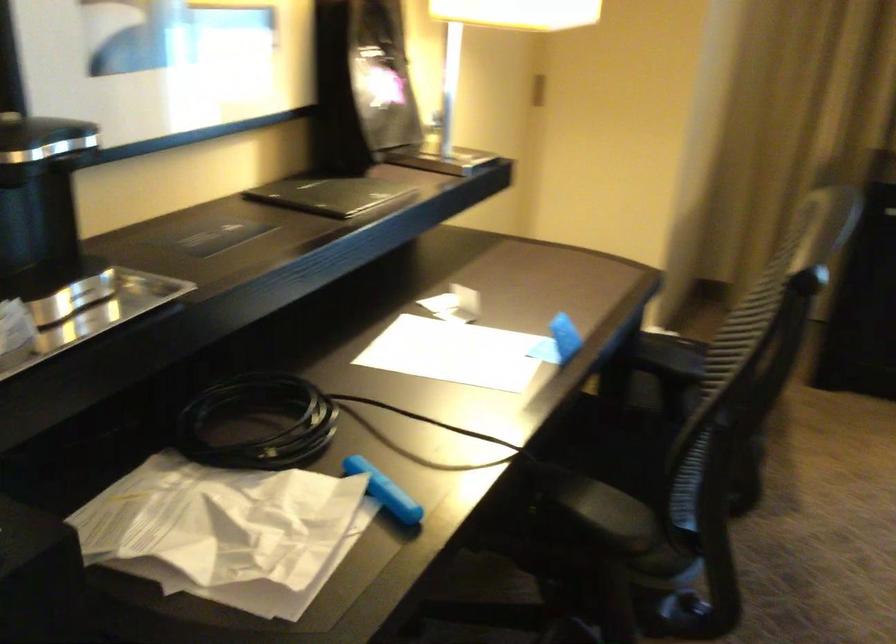
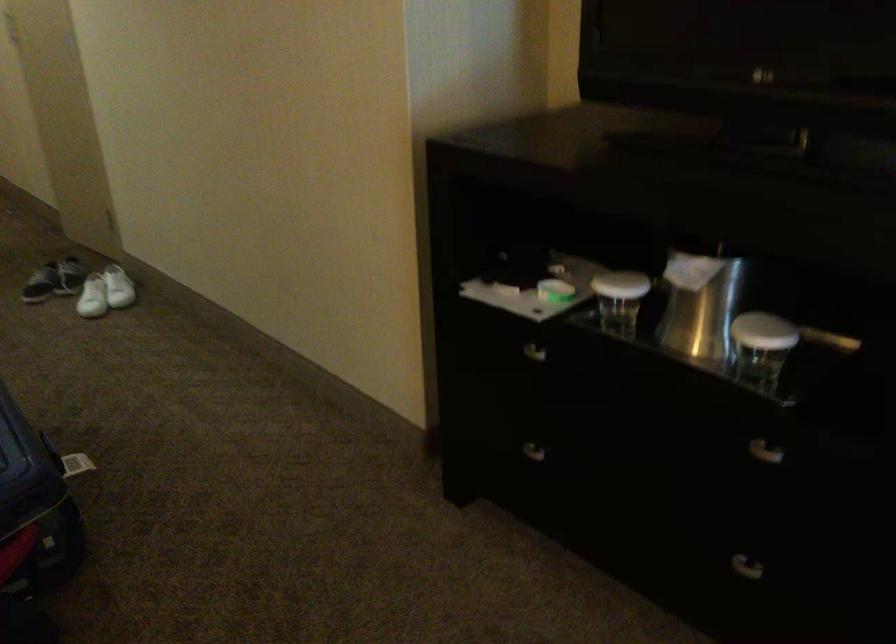
The first image is from the beginning of the video and the second image is from the end. How did the camera likely rotate when shooting the video?

The camera rotated toward left-down.